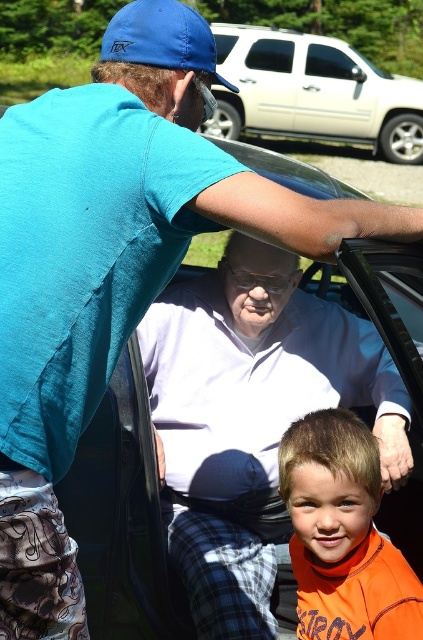
You are standing in the park and see the orange fleece at lower right and the white matte suv at upper center. Which object is closer to the left side of the scene?

The orange fleece at lower right is positioned on the left side of the white matte suv at upper center, so it is closer to the left side of the scene.

You are a photographer trying to capture a clear shot of the orange fleece at lower right and the white matte car door at upper center. Which object is closer to the camera?

The orange fleece at lower right is closer to the camera because it is in front of the white matte car door at upper center.

You are standing in the park and see the matte black car at center and the orange fleece at lower right. Which object is located to the right of the other?

The matte black car at center is positioned on the left side of orange fleece at lower right, so the orange fleece at lower right is to the right of the matte black car at center.